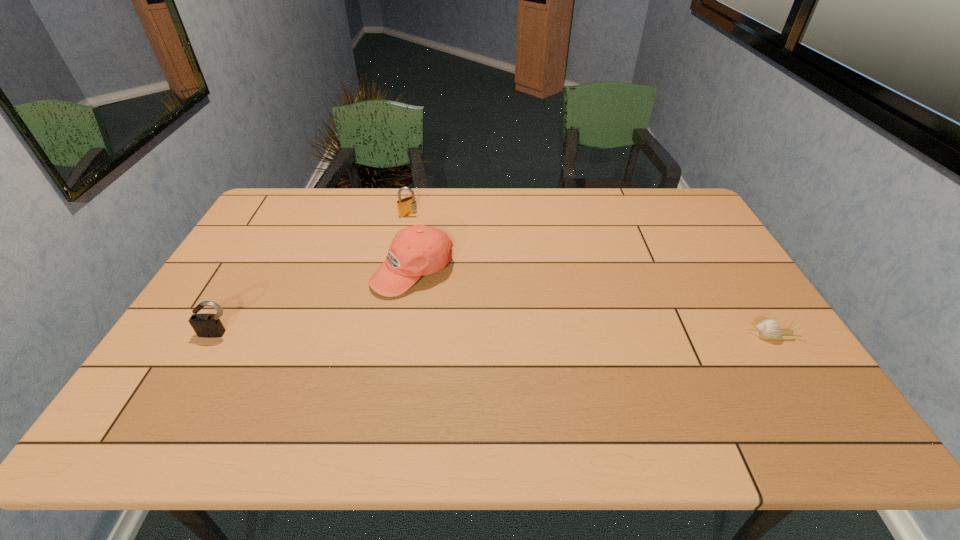
I want to click on free space between the escargot and the third nearest object, so click(x=592, y=303).

At what (x,y) coordinates should I click in order to perform the action: click on vacant space that is in between the left padlock and the shortest object. Please return your answer as a coordinate pair (x, y). Looking at the image, I should click on (495, 334).

The height and width of the screenshot is (540, 960). Identify the location of vacant area that lies between the farthest object and the left padlock. (313, 274).

The image size is (960, 540). Identify the location of free spot between the rightmost object and the right padlock. (590, 274).

Locate which object is the second closest to the escargot. Please provide its 2D coordinates. Your answer should be formatted as a tuple, i.e. [(x, y)], where the tuple contains the x and y coordinates of a point satisfying the conditions above.

[(407, 206)]

Identify which object is located as the nearest to the right padlock. Please provide its 2D coordinates. Your answer should be formatted as a tuple, i.e. [(x, y)], where the tuple contains the x and y coordinates of a point satisfying the conditions above.

[(418, 250)]

You are a GUI agent. You are given a task and a screenshot of the screen. Output one action in this format:
    pyautogui.click(x=<x>, y=<y>)
    Task: Click on the vacant space that satisfies the following two spatial constraints: 1. on the front side of the second farthest object; 2. on the right side of the farther padlock
    The width and height of the screenshot is (960, 540).
    Given the screenshot: What is the action you would take?
    pyautogui.click(x=396, y=272)

This screenshot has width=960, height=540. Find the location of `vacant space that satisfies the following two spatial constraints: 1. with the keyhole on the front of the rightmost object; 2. on the shell of the nearer padlock`. vacant space that satisfies the following two spatial constraints: 1. with the keyhole on the front of the rightmost object; 2. on the shell of the nearer padlock is located at coordinates (217, 335).

Where is `vacant area in the image that satisfies the following two spatial constraints: 1. on the front side of the farthest object; 2. on the shell of the rightmost object`? The height and width of the screenshot is (540, 960). vacant area in the image that satisfies the following two spatial constraints: 1. on the front side of the farthest object; 2. on the shell of the rightmost object is located at coordinates (382, 335).

Locate an element on the screen. vacant space that satisfies the following two spatial constraints: 1. on the front side of the rightmost object; 2. on the shell of the right padlock is located at coordinates (382, 335).